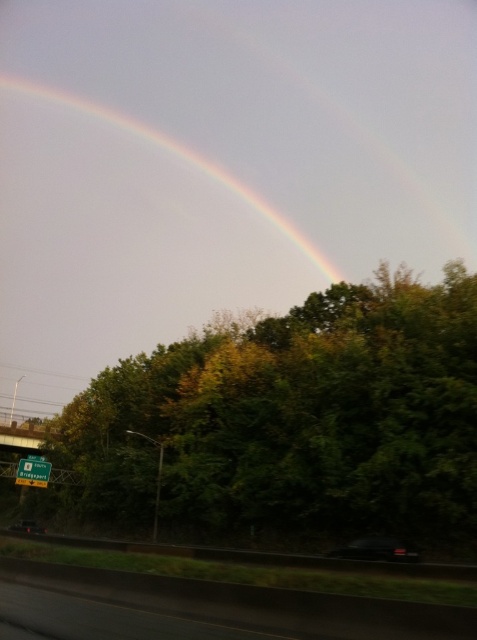
Looking at this image, between green leafy tree at upper center and green plastic sign at lower left, which one is positioned lower?

Positioned lower is green plastic sign at lower left.

Can you confirm if green leafy tree at upper center is positioned to the right of green plastic sign at lower left?

Correct, you'll find green leafy tree at upper center to the right of green plastic sign at lower left.

Is point (398, 518) positioned after point (19, 465)?

No, (398, 518) is in front of (19, 465).

The image size is (477, 640). I want to click on green leafy tree at upper center, so click(x=296, y=419).

Does green leafy tree at upper center appear under rainbow at upper center?

Indeed, green leafy tree at upper center is positioned under rainbow at upper center.

Who is higher up, green leafy tree at upper center or rainbow at upper center?

rainbow at upper center

Where is `green leafy tree at upper center`? green leafy tree at upper center is located at coordinates [296, 419].

Does black asphalt highway at lower center have a lesser width compared to black glossy car at lower center?

Correct, black asphalt highway at lower center's width is less than black glossy car at lower center's.

Who is more distant from viewer, (130, 593) or (41, 525)?

Point (41, 525)

Locate an element on the screen. Image resolution: width=477 pixels, height=640 pixels. black asphalt highway at lower center is located at coordinates (252, 604).